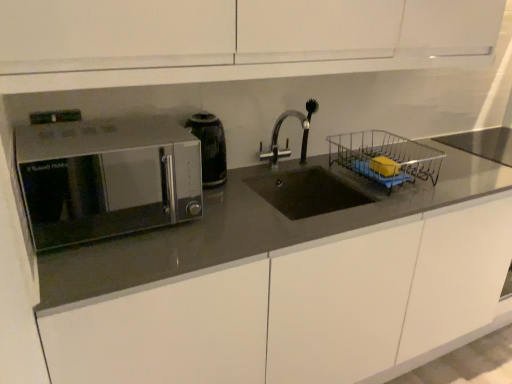
Question: Does point (280, 153) appear closer or farther from the camera than point (391, 140)?

Choices:
 (A) farther
 (B) closer

Answer: (B)

Question: From a real-world perspective, is silver metallic faucet at center above or below metallic wire basket at center right?

Choices:
 (A) below
 (B) above

Answer: (B)

Question: Considering the real-world distances, which object is closest to the black glossy electric kettle at center-left?

Choices:
 (A) silver metallic faucet at center
 (B) metallic wire basket at center right
 (C) satin silver microwave at left
 (D) satin metallic microwave at left

Answer: (A)

Question: Estimate the real-world distances between objects in this image. Which object is closer to the satin metallic microwave at left?

Choices:
 (A) satin silver microwave at left
 (B) black glossy electric kettle at center-left
 (C) metallic wire basket at center right
 (D) silver metallic faucet at center

Answer: (C)